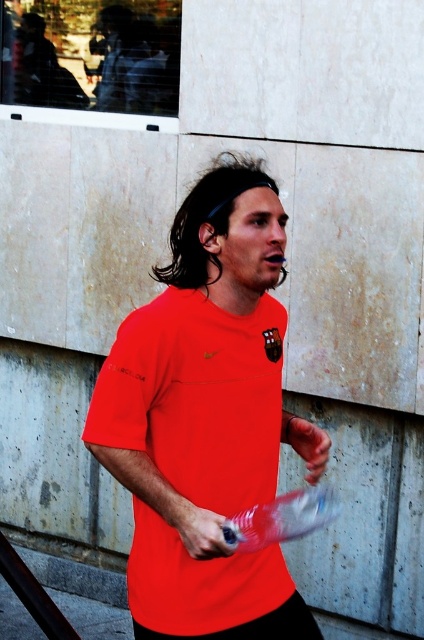
You are an observer standing in front of the man in the image. You notice the matte red shirt at center and the smooth skin hand at center. Which object is located to the left of the other?

The matte red shirt at center is positioned on the left side of smooth skin hand at center.

You are a photographer standing at a distance of 6 feet from the man in the image. You want to capture a closeup shot of the matte red shirt at center. Based on the distance provided, will you need to adjust your position to ensure the shirt is in focus?

The matte red shirt at center is 6.41 feet away from the camera. Since you are standing at 6 feet, you are slightly closer than the shirt. To ensure the shirt is in focus, you should move back approximately 0.41 feet to match the camera distance.